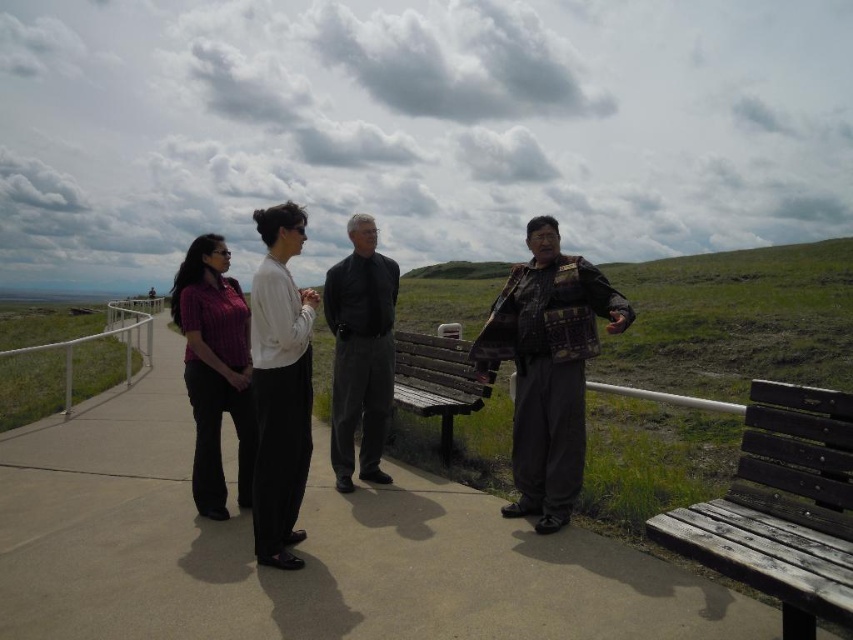
Looking at this image, you are standing at point (469, 371) and want to walk to point (347, 355). Is the path clear between these two points?

Yes, the path is clear between point (347, 355) and point (469, 371) because there are no obstacles mentioned in the scene description.

You are planning to sit on the weathered wood bench at lower right while observing the matte purple shirt at left. Considering their sizes, which object would require more space if you wanted to place an identical copy next to them?

The matte purple shirt at left would require more space because the weathered wood bench at lower right is smaller in size compared to the matte purple shirt at left.

From the picture: You are standing at the entrance of the pathway and want to find the plaid fabric jacket at center. According to the coordinates provided, in which direction should you walk to reach it?

The plaid fabric jacket at center is located at coordinates point (548, 368). Since the coordinate system is normalized, with (0, 0) at the bottom left corner and (852, 639) at the top right corner, the jacket is positioned in the upper middle section of the image. To reach it, you should walk towards the center of the pathway and slightly towards the right side of the image.